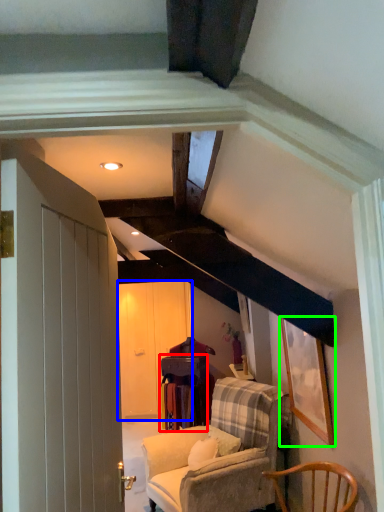
Question: Which is nearer to the table (highlighted by a red box)? glass door (highlighted by a blue box) or picture frame (highlighted by a green box).

Choices:
 (A) glass door
 (B) picture frame

Answer: (A)